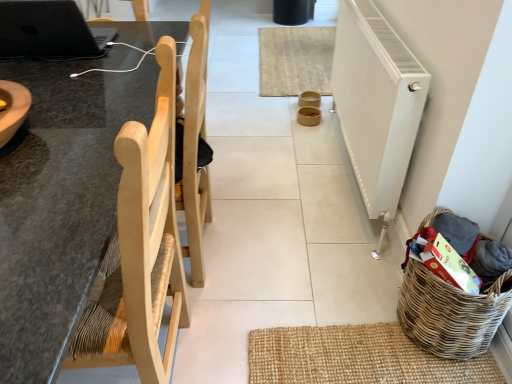
Where is `vacant space in white textured radiator at right (from a real-world perspective)`? This screenshot has width=512, height=384. vacant space in white textured radiator at right (from a real-world perspective) is located at coordinates (346, 167).